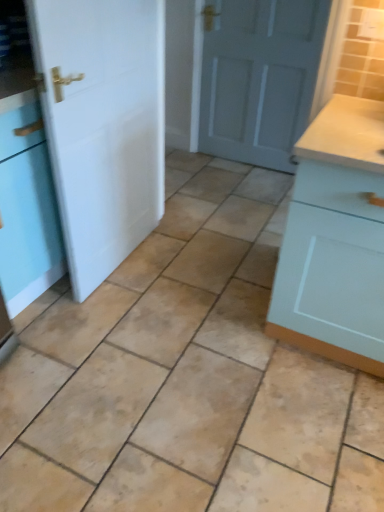
Locate an element on the screen. free space in front of white matte door at left, which ranks as the second door in right-to-left order is located at coordinates (117, 322).